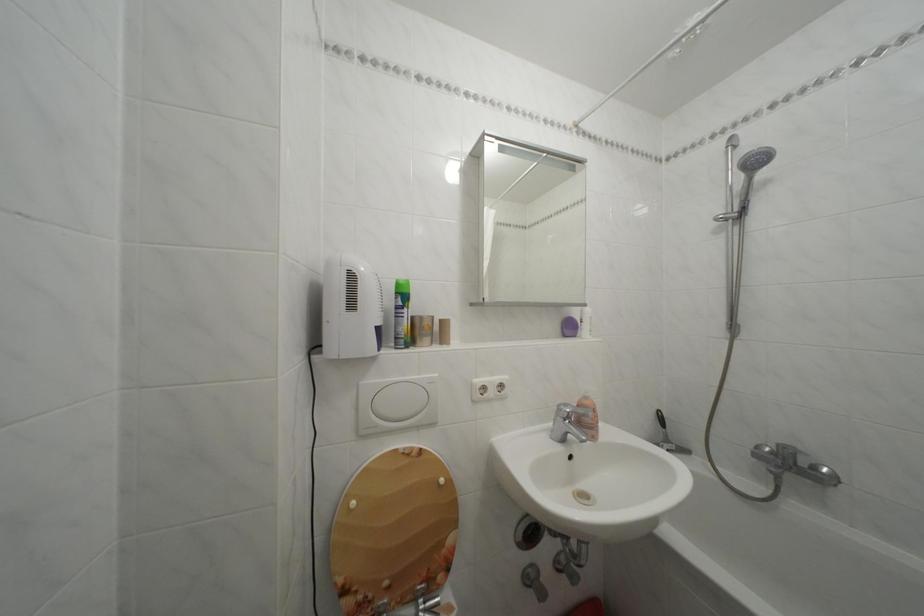
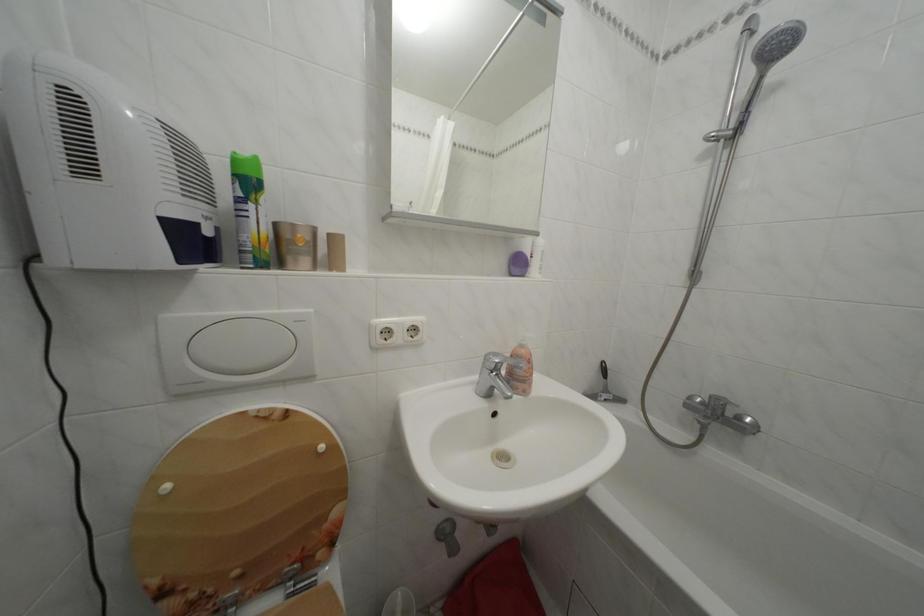
The point at (594, 403) is marked in the first image. Where is the corresponding point in the second image?

(530, 352)